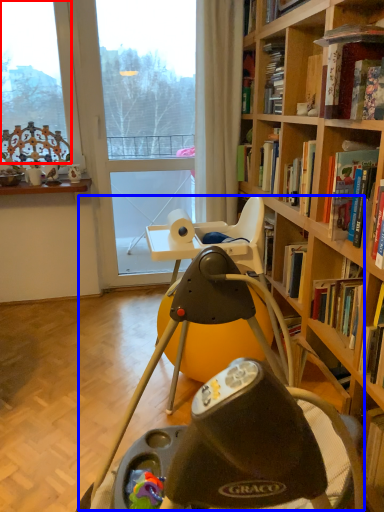
Question: Which point is further to the camera, window (highlighted by a red box) or swivel chair (highlighted by a blue box)?

Choices:
 (A) window
 (B) swivel chair

Answer: (A)